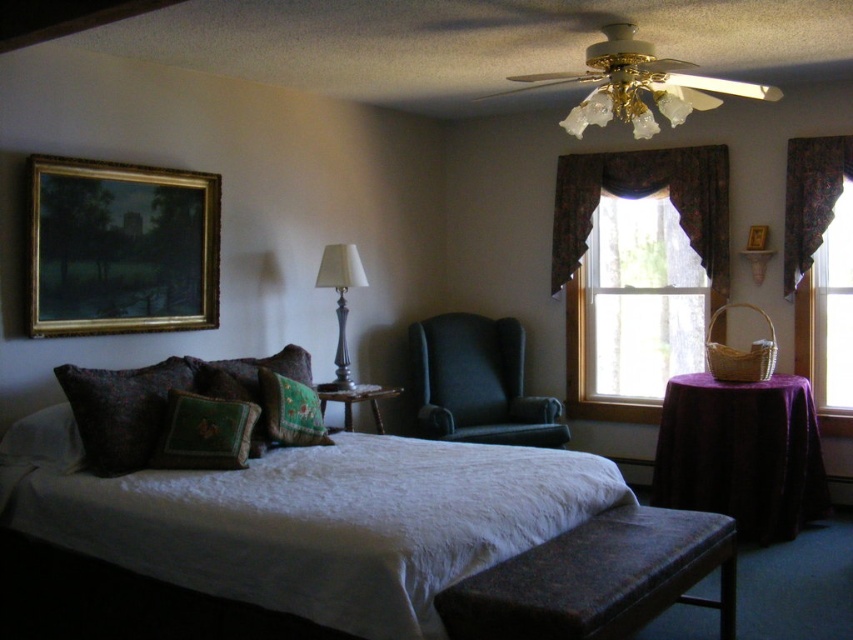
Is velvet dark brown bench at lower center above green textured pillow at center?

No.

Is velvet dark brown bench at lower center below green textured pillow at center?

Yes, velvet dark brown bench at lower center is below green textured pillow at center.

Which is in front, point (585, 545) or point (216, 449)?

Point (585, 545)

Find the location of `velvet dark brown bench at lower center`. velvet dark brown bench at lower center is located at coordinates (598, 579).

Does velvety dark green pillow at lower left have a greater height compared to gold metallic picture frame at upper center?

Correct, velvety dark green pillow at lower left is much taller as gold metallic picture frame at upper center.

Between point (111, 376) and point (747, 240), which one is positioned behind?

Positioned behind is point (747, 240).

Between point (155, 445) and point (764, 225), which one is positioned in front?

Point (155, 445)

This screenshot has width=853, height=640. Find the location of `velvety dark green pillow at lower left`. velvety dark green pillow at lower left is located at coordinates (122, 410).

Between gold-framed painting at upper left and transparent glass window at center, which one has more height?

transparent glass window at center is taller.

Which is more to the left, gold-framed painting at upper left or transparent glass window at center?

Positioned to the left is gold-framed painting at upper left.

Is point (99, 196) closer to camera compared to point (846, 376)?

Yes, point (99, 196) is in front of point (846, 376).

Locate an element on the screen. gold-framed painting at upper left is located at coordinates (120, 248).